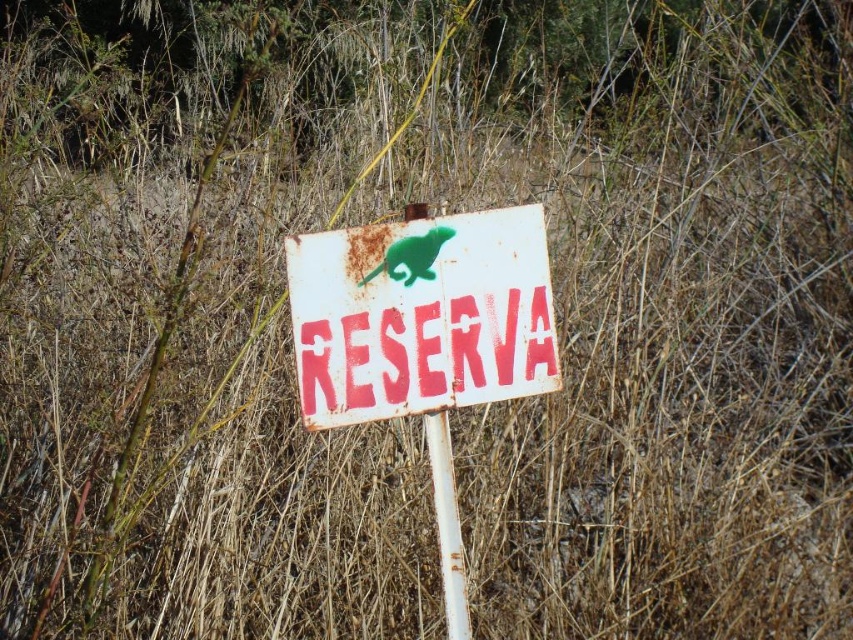
Question: Considering the relative positions of rusty metal sign at center and rusty metal pole at center in the image provided, where is rusty metal sign at center located with respect to rusty metal pole at center?

Choices:
 (A) left
 (B) right

Answer: (A)

Question: Which point is closer to the camera?

Choices:
 (A) rusty metal pole at center
 (B) rusty metal sign at center

Answer: (B)

Question: Can you confirm if rusty metal sign at center is thinner than rusty metal pole at center?

Choices:
 (A) yes
 (B) no

Answer: (B)

Question: Which point is farther from the camera taking this photo?

Choices:
 (A) (518, 336)
 (B) (445, 509)

Answer: (B)

Question: Does rusty metal sign at center appear over rusty metal pole at center?

Choices:
 (A) no
 (B) yes

Answer: (B)